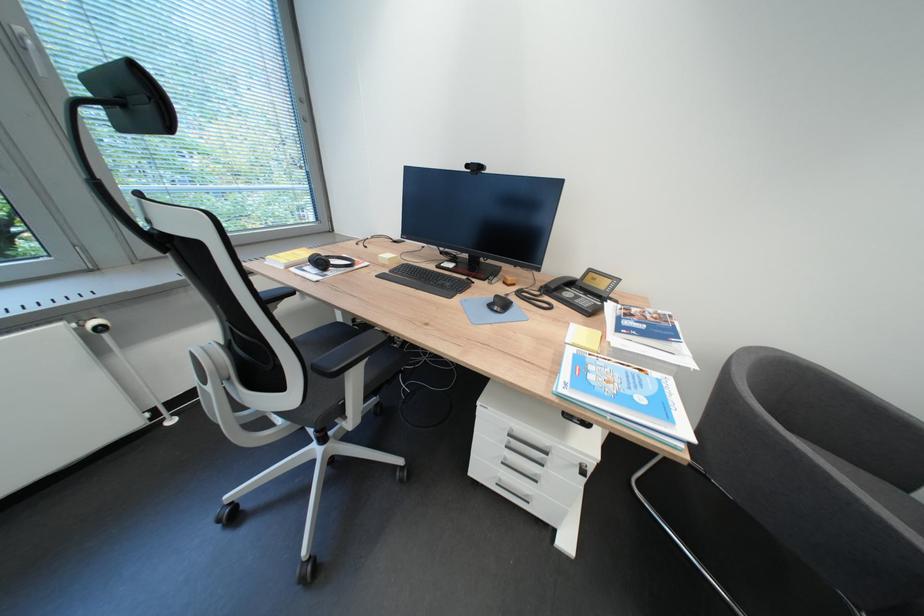
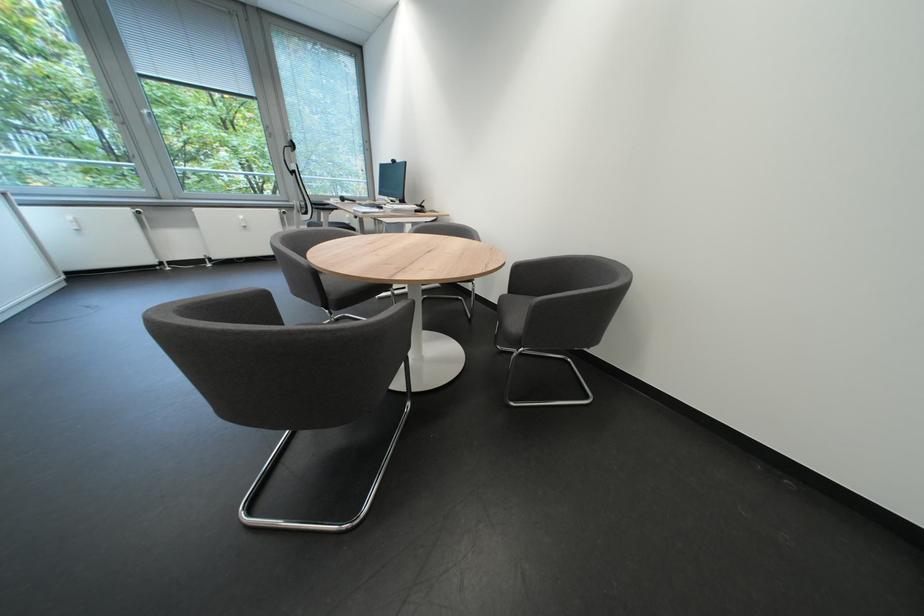
Which direction would the cameraman need to move to produce the second image?

The cameraman walked toward right, backward.